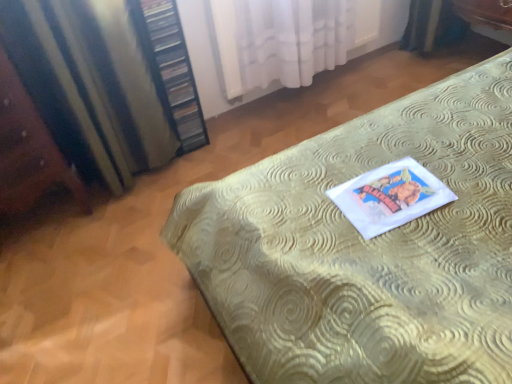
Question: Looking at their shapes, would you say satin striped curtain at left, which is the 1th curtain in left-to-right order, is wider or thinner than wooden bookshelf at left?

Choices:
 (A) wide
 (B) thin

Answer: (A)

Question: In the image, is satin striped curtain at left, positioned as the second curtain in right-to-left order, on the left side or the right side of wooden bookshelf at left?

Choices:
 (A) left
 (B) right

Answer: (A)

Question: Which object is the farthest from the gold textured bed at center?

Choices:
 (A) satin striped curtain at left, positioned as the second curtain in right-to-left order
 (B) wooden bookshelf at left
 (C) brown wooden vanity at left
 (D) white sheer curtain at upper center, which is the second curtain from left to right

Answer: (C)

Question: Based on their relative distances, which object is farther from the gold textured bed at center?

Choices:
 (A) satin striped curtain at left, positioned as the second curtain in right-to-left order
 (B) brown wooden vanity at left
 (C) white sheer curtain at upper center, which is the second curtain from left to right
 (D) wooden bookshelf at left

Answer: (B)